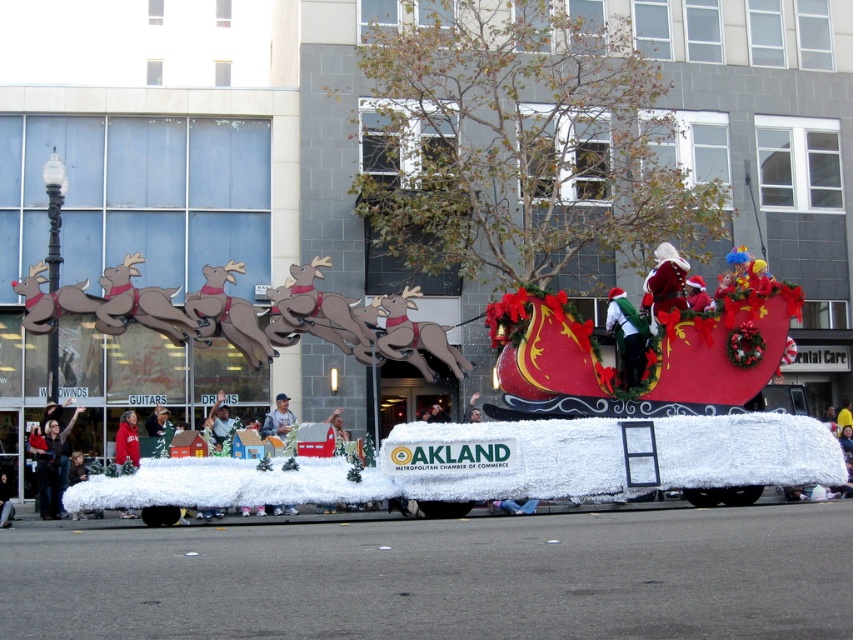
Question: Which point is closer to the camera?

Choices:
 (A) dark gray sweater at lower left
 (B) velvet santa hat at center

Answer: (B)

Question: Can you confirm if dark gray sweater at lower left is positioned to the right of velvet santa hat at center?

Choices:
 (A) no
 (B) yes

Answer: (A)

Question: Is dark gray sweater at lower left thinner than velvet santa hat at center?

Choices:
 (A) yes
 (B) no

Answer: (B)

Question: Which object is farther from the camera taking this photo?

Choices:
 (A) dark gray sweater at lower left
 (B) velvet santa hat at center

Answer: (A)

Question: Can you confirm if dark gray sweater at lower left is positioned below velvet santa hat at center?

Choices:
 (A) no
 (B) yes

Answer: (B)

Question: Which point appears closest to the camera in this image?

Choices:
 (A) (45, 406)
 (B) (647, 332)

Answer: (B)